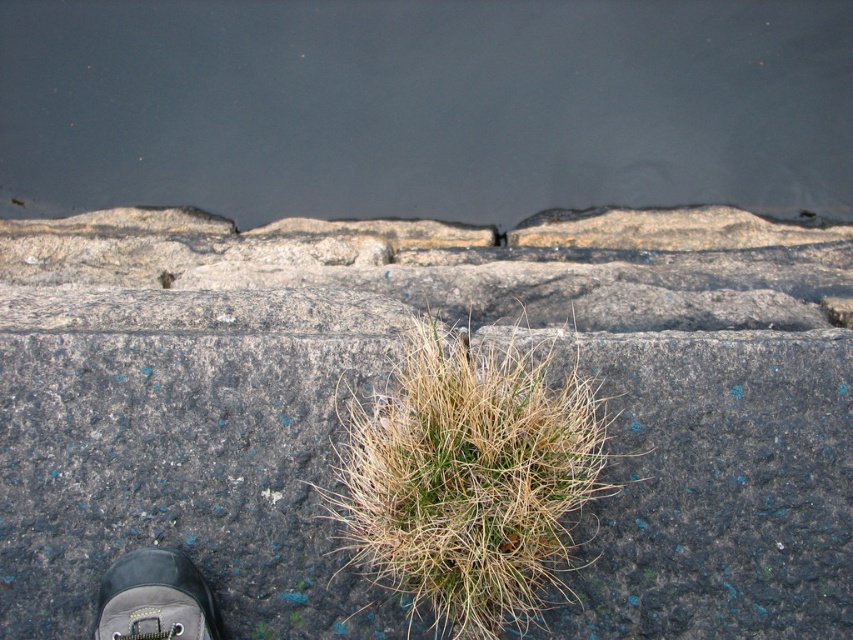
You are designing a garden and want to plant flowers between the dry grass at center and the leather shoe at lower left. Given their widths, which area should you choose to ensure the flowers have enough space to grow?

The dry grass at center has a larger width than the leather shoe at lower left, so planting flowers in the area near the dry grass at center would provide more space for growth.

You need to place a small potted plant between the gray concrete pavement at center and the dry grass at center. Which area has more space to accommodate the plant?

The dry grass at center has more space because the gray concrete pavement at center is smaller in size.